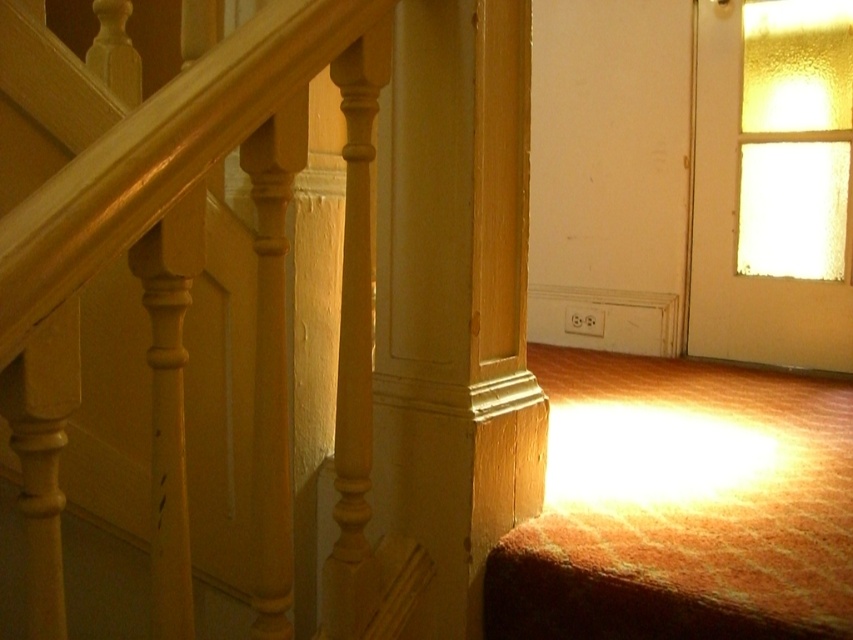
Question: Does matte wood railing at upper left appear on the left side of wooden post at center?

Choices:
 (A) no
 (B) yes

Answer: (B)

Question: Which of the following is the farthest from the observer?

Choices:
 (A) wooden post at center
 (B) matte wood railing at upper left

Answer: (A)

Question: Among these points, which one is nearest to the camera?

Choices:
 (A) coord(392,92)
 (B) coord(13,280)

Answer: (B)

Question: Does matte wood railing at upper left appear on the left side of wooden post at center?

Choices:
 (A) yes
 (B) no

Answer: (A)

Question: Can you confirm if matte wood railing at upper left is bigger than wooden post at center?

Choices:
 (A) no
 (B) yes

Answer: (B)